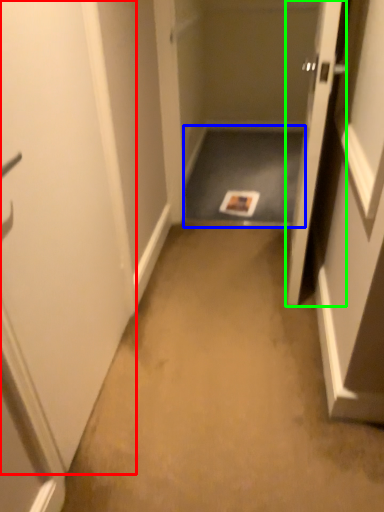
Question: Based on their relative distances, which object is nearer to door (highlighted by a red box)? Choose from corridor (highlighted by a blue box) and door (highlighted by a green box).

Choices:
 (A) corridor
 (B) door

Answer: (B)